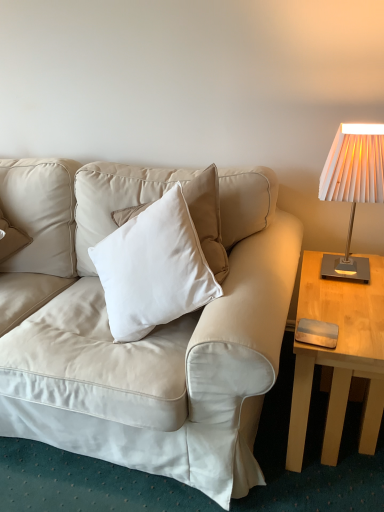
At what (x,y) coordinates should I click in order to perform the action: click on beige leather couch at center. Please return your answer as a coordinate pair (x, y). The height and width of the screenshot is (512, 384). Looking at the image, I should click on (147, 335).

In order to face beige leather pillow at upper left, should I rotate leftwards or rightwards?

A 23.970 degree turn to the left will do.

I want to click on beige leather pillow at upper left, so click(40, 213).

I want to click on beige leather couch at center, so click(x=147, y=335).

Is beige leather couch at center completely or partially outside of beige leather pillow at upper left?

Yes.

Which object is wider, beige leather couch at center or beige leather pillow at upper left?

Wider between the two is beige leather pillow at upper left.

Could you tell me if beige leather couch at center is turned towards beige leather pillow at upper left?

No.

Is the depth of beige leather couch at center less than that of beige leather pillow at upper left?

Yes.

Is beige leather pillow at upper left wider or thinner than metallic silver pad at right?

beige leather pillow at upper left is wider than metallic silver pad at right.

Is beige leather pillow at upper left facing away from metallic silver pad at right?

beige leather pillow at upper left is not turned away from metallic silver pad at right.

Is beige leather pillow at upper left touching metallic silver pad at right?

No, beige leather pillow at upper left is not beside metallic silver pad at right.

From the image's perspective, is beige leather pillow at upper left located above or below metallic silver pad at right?

beige leather pillow at upper left is situated higher than metallic silver pad at right in the image.

From the image's perspective, is beige leather couch at center located beneath white pleated fabric lampshade at right?

Correct, beige leather couch at center appears lower than white pleated fabric lampshade at right in the image.

Is beige leather couch at center completely or partially outside of white pleated fabric lampshade at right?

Yes.

Is the surface of beige leather couch at center in direct contact with white pleated fabric lampshade at right?

No, beige leather couch at center is not with white pleated fabric lampshade at right.

Is beige leather couch at center facing towards white pleated fabric lampshade at right?

No, beige leather couch at center is not turned towards white pleated fabric lampshade at right.

Measure the distance from beige leather pillow at upper left to white pleated fabric lampshade at right.

beige leather pillow at upper left and white pleated fabric lampshade at right are 3.64 feet apart from each other.

Is white pleated fabric lampshade at right located within beige leather pillow at upper left?

No, beige leather pillow at upper left does not contain white pleated fabric lampshade at right.

Consider the image. Would you say beige leather pillow at upper left is a long distance from white pleated fabric lampshade at right?

beige leather pillow at upper left is far away from white pleated fabric lampshade at right.

Considering the sizes of objects beige leather pillow at upper left and white pleated fabric lampshade at right in the image provided, who is thinner, beige leather pillow at upper left or white pleated fabric lampshade at right?

With smaller width is white pleated fabric lampshade at right.

From a real-world perspective, who is located lower, beige leather couch at center or metallic silver pad at right?

From a 3D spatial view, metallic silver pad at right is below.

Can we say beige leather couch at center lies outside metallic silver pad at right?

beige leather couch at center is positioned outside metallic silver pad at right.

Locate an element on the screen. The width and height of the screenshot is (384, 512). pad to the right of beige leather couch at center is located at coordinates (317, 333).

Which is in front, point (334, 336) or point (229, 419)?

The point (334, 336) is closer to the camera.

In terms of width, does metallic silver pad at right look wider or thinner when compared to beige leather couch at center?

Clearly, metallic silver pad at right has less width compared to beige leather couch at center.

Is metallic silver pad at right taller or shorter than beige leather couch at center?

Considering their sizes, metallic silver pad at right has less height than beige leather couch at center.

From the image's perspective, which object appears higher, metallic silver pad at right or beige leather couch at center?

beige leather couch at center is shown above in the image.

From a real-world perspective, is beige leather couch at center positioned over light wood table at right based on gravity?

Yes, from a real-world perspective, beige leather couch at center is on top of light wood table at right.

Is beige leather couch at center positioned with its back to light wood table at right?

That's not correct — beige leather couch at center is not looking away from light wood table at right.

Based on the photo, can you confirm if beige leather couch at center is bigger than light wood table at right?

Yes, beige leather couch at center is bigger than light wood table at right.

At what (x,y) coordinates should I click in order to perform the action: click on studio couch above the light wood table at right (from a real-world perspective). Please return your answer as a coordinate pair (x, y). Looking at the image, I should click on (147, 335).

You are a GUI agent. You are given a task and a screenshot of the screen. Output one action in this format:
    pyautogui.click(x=<x>, y=<y>)
    Task: Click on the studio couch on the right of the beige leather pillow at upper left
    The image size is (384, 512).
    Given the screenshot: What is the action you would take?
    pyautogui.click(x=147, y=335)

The image size is (384, 512). I want to click on pad in front of the beige leather pillow at upper left, so click(317, 333).

Estimate the real-world distances between objects in this image. Which object is further from metallic silver pad at right, white pleated fabric lampshade at right or beige leather pillow at upper left?

beige leather pillow at upper left is positioned further to the anchor metallic silver pad at right.

In the scene shown: Looking at the image, which one is located closer to white pleated fabric lampshade at right, light wood table at right or beige leather pillow at upper left?

light wood table at right is closer to white pleated fabric lampshade at right.

When comparing their distances from light wood table at right, does beige leather couch at center or beige leather pillow at upper left seem closer?

Based on the image, beige leather couch at center appears to be nearer to light wood table at right.

Estimate the real-world distances between objects in this image. Which object is further from metallic silver pad at right, beige leather couch at center or white pleated fabric lampshade at right?

Among the two, beige leather couch at center is located further to metallic silver pad at right.

Looking at this image, estimate the real-world distances between objects in this image. Which object is further from white pleated fabric lampshade at right, metallic silver pad at right or beige leather pillow at upper left?

Based on the image, beige leather pillow at upper left appears to be further to white pleated fabric lampshade at right.

Which object lies further to the anchor point light wood table at right, metallic silver pad at right or beige leather couch at center?

beige leather couch at center is further to light wood table at right.

From the image, which object appears to be farther from beige leather couch at center, metallic silver pad at right or beige leather pillow at upper left?

The object further to beige leather couch at center is metallic silver pad at right.

Based on the photo, estimate the real-world distances between objects in this image. Which object is closer to beige leather couch at center, metallic silver pad at right or white pleated fabric lampshade at right?

metallic silver pad at right.

Where is `lamp between beige leather pillow at upper left and light wood table at right from left to right`? The height and width of the screenshot is (512, 384). lamp between beige leather pillow at upper left and light wood table at right from left to right is located at coordinates (353, 187).

This screenshot has height=512, width=384. Find the location of `studio couch situated between beige leather pillow at upper left and white pleated fabric lampshade at right from left to right`. studio couch situated between beige leather pillow at upper left and white pleated fabric lampshade at right from left to right is located at coordinates (147, 335).

Where is `pad between beige leather pillow at upper left and light wood table at right from left to right`? Image resolution: width=384 pixels, height=512 pixels. pad between beige leather pillow at upper left and light wood table at right from left to right is located at coordinates (317, 333).

Identify the location of studio couch located between beige leather pillow at upper left and light wood table at right in the left-right direction. Image resolution: width=384 pixels, height=512 pixels. pyautogui.click(x=147, y=335).